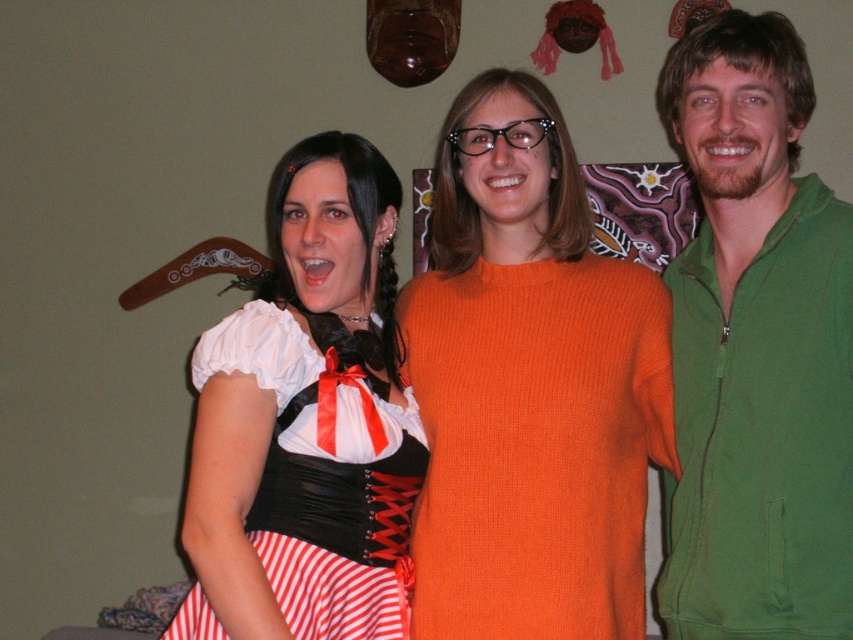
From the picture: Does green zip-up hoodie at right come in front of matte black corset at center?

No, green zip-up hoodie at right is behind matte black corset at center.

Is green zip-up hoodie at right to the right of matte black corset at center from the viewer's perspective?

Indeed, green zip-up hoodie at right is positioned on the right side of matte black corset at center.

Who is more distant from viewer, [836,611] or [254,481]?

Point [254,481]

At what (x,y) coordinates should I click in order to perform the action: click on green zip-up hoodie at right. Please return your answer as a coordinate pair (x, y). This screenshot has width=853, height=640. Looking at the image, I should click on (757, 349).

Which is more to the left, orange knitted sweater at center or matte black corset at center?

matte black corset at center

Describe the element at coordinates (529, 387) in the screenshot. The width and height of the screenshot is (853, 640). I see `orange knitted sweater at center` at that location.

Locate an element on the screen. orange knitted sweater at center is located at coordinates (529, 387).

Which is above, orange knitted sweater at center or green zip-up hoodie at right?

Positioned higher is green zip-up hoodie at right.

Which is more to the right, orange knitted sweater at center or green zip-up hoodie at right?

green zip-up hoodie at right is more to the right.

The height and width of the screenshot is (640, 853). What are the coordinates of `orange knitted sweater at center` in the screenshot? It's located at [x=529, y=387].

Locate an element on the screen. orange knitted sweater at center is located at coordinates (529, 387).